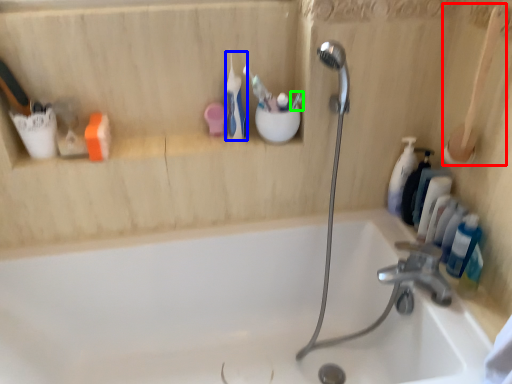
Question: Based on their relative distances, which object is farther from brush (highlighted by a red box)? Choose from toothbrush (highlighted by a blue box) and toothbrush (highlighted by a green box).

Choices:
 (A) toothbrush
 (B) toothbrush

Answer: (A)